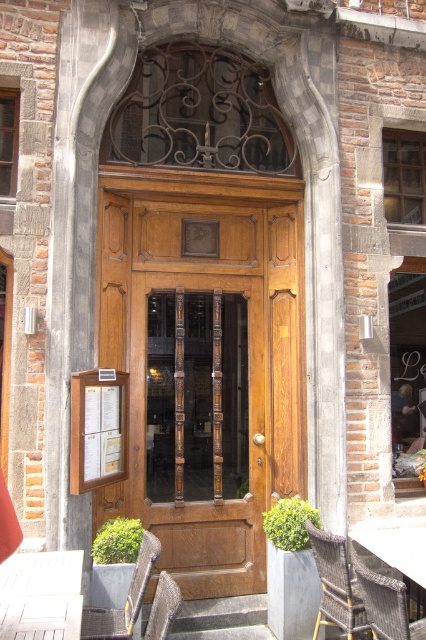
Does rattan chair at lower right have a lesser height compared to metallic woven chair at lower center?

Incorrect, rattan chair at lower right's height does not fall short of metallic woven chair at lower center's.

Is rattan chair at lower right positioned behind metallic woven chair at lower center?

Yes, it is behind metallic woven chair at lower center.

You are a GUI agent. You are given a task and a screenshot of the screen. Output one action in this format:
    pyautogui.click(x=<x>, y=<y>)
    Task: Click on the rattan chair at lower right
    The width and height of the screenshot is (426, 640).
    Given the screenshot: What is the action you would take?
    pyautogui.click(x=336, y=584)

Who is taller, wooden table at lower left or wooden textured chair at lower left?

Standing taller between the two is wooden textured chair at lower left.

Who is more forward, (5, 627) or (137, 573)?

Point (5, 627) is more forward.

At what (x,y) coordinates should I click in order to perform the action: click on wooden table at lower left. Please return your answer as a coordinate pair (x, y). The height and width of the screenshot is (640, 426). Looking at the image, I should click on (40, 618).

Who is more distant from viewer, (207, 528) or (66, 628)?

The point (207, 528) is more distant.

Is point (298, 314) farther from camera compared to point (11, 630)?

Yes.

This screenshot has width=426, height=640. In order to click on wooden door at center in this screenshot , I will do `click(204, 364)`.